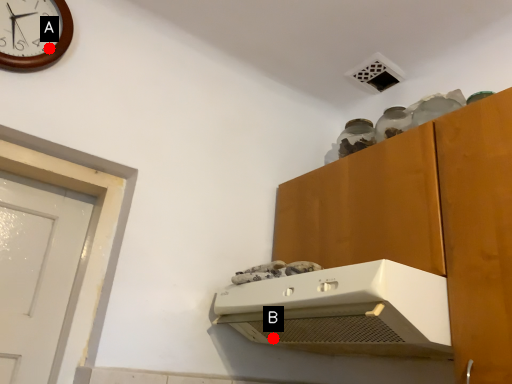
Question: Two points are circled on the image, labeled by A and B beside each circle. Which point is further to the camera?

Choices:
 (A) A is further
 (B) B is further

Answer: (B)